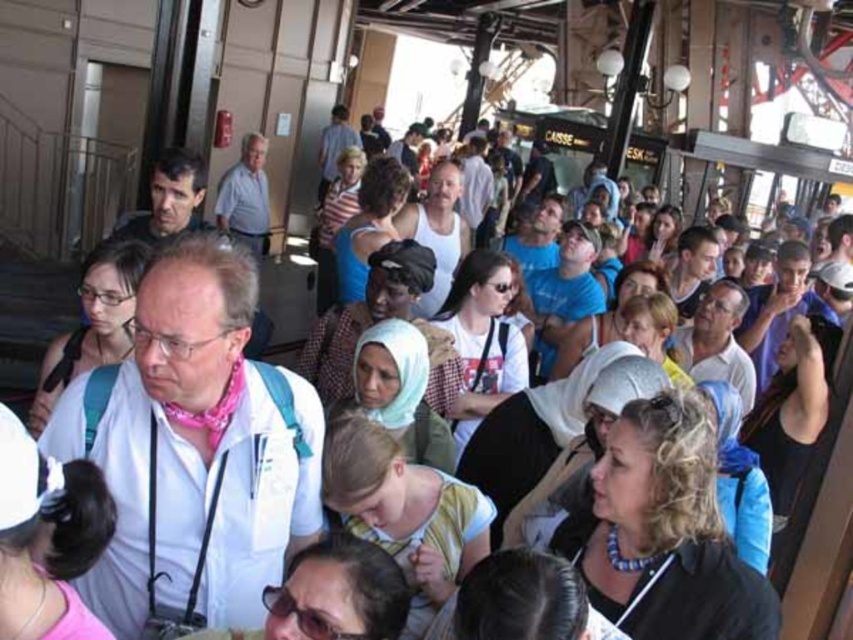
Which is more to the left, white cotton shirt at center or black leather jacket at lower right?

Positioned to the left is white cotton shirt at center.

Which of these two, white cotton shirt at center or black leather jacket at lower right, stands shorter?

Standing shorter between the two is black leather jacket at lower right.

Locate an element on the screen. The image size is (853, 640). white cotton shirt at center is located at coordinates (194, 449).